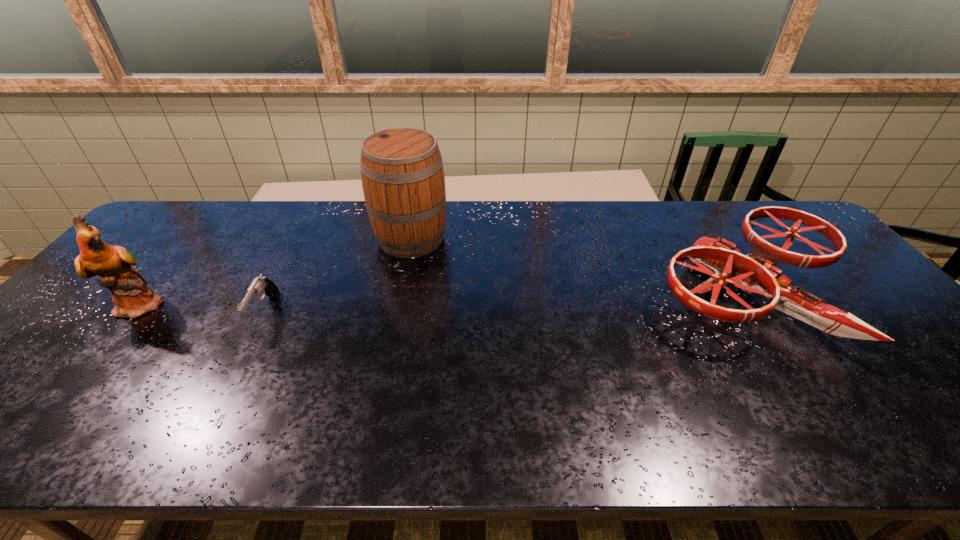
At what (x,y) coordinates should I click in order to perform the action: click on cider at the far edge. Please return your answer as a coordinate pair (x, y). This screenshot has height=540, width=960. Looking at the image, I should click on (403, 181).

The height and width of the screenshot is (540, 960). Identify the location of drone that is positioned at the far edge. (754, 273).

Find the location of a particular element. Image resolution: width=960 pixels, height=540 pixels. object that is at the left edge is located at coordinates (133, 298).

At what (x,y) coordinates should I click in order to perform the action: click on object that is at the right edge. Please return your answer as a coordinate pair (x, y). Looking at the image, I should click on point(754,273).

Where is `object at the far right corner`? This screenshot has height=540, width=960. object at the far right corner is located at coordinates (754, 273).

This screenshot has width=960, height=540. Find the location of `vacant space at the far edge of the desktop`. vacant space at the far edge of the desktop is located at coordinates (285, 207).

In the image, there is a desktop. At what (x,y) coordinates should I click in order to perform the action: click on free region at the near edge. Please return your answer as a coordinate pair (x, y). The height and width of the screenshot is (540, 960). Looking at the image, I should click on (568, 431).

Locate an element on the screen. Image resolution: width=960 pixels, height=540 pixels. free spot at the right edge of the desktop is located at coordinates (878, 373).

Identify the location of vacant area at the far left corner of the desktop. (180, 224).

Find the location of `free space between the parrot and the second shortest object`. free space between the parrot and the second shortest object is located at coordinates (444, 299).